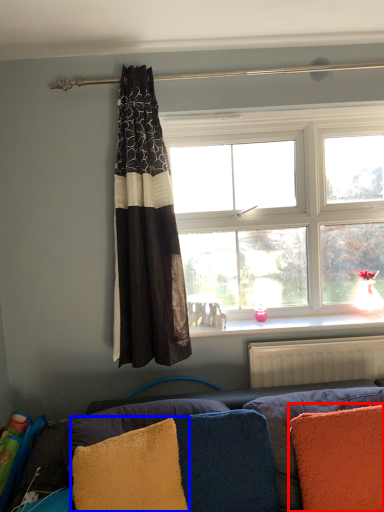
Question: Which point is closer to the camera, pillow (highlighted by a red box) or pillow (highlighted by a blue box)?

Choices:
 (A) pillow
 (B) pillow

Answer: (B)